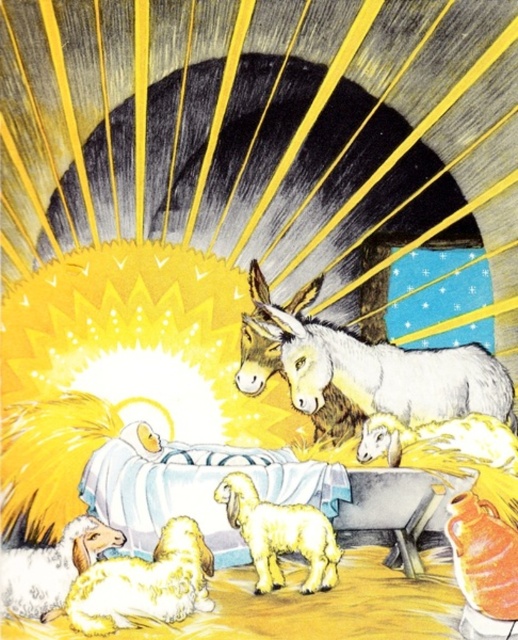
Question: Which point is farther from the camera taking this photo?

Choices:
 (A) (169, 564)
 (B) (309, 577)
 (C) (53, 554)

Answer: (B)

Question: Does fluffy white sheep at lower left come behind fluffy white lamb at center?

Choices:
 (A) no
 (B) yes

Answer: (A)

Question: Can you confirm if white textured donkey at center is thinner than fluffy white lamb at center?

Choices:
 (A) yes
 (B) no

Answer: (B)

Question: Among these points, which one is farthest from the camera?

Choices:
 (A) (54, 589)
 (B) (299, 328)

Answer: (B)

Question: Can you confirm if white textured donkey at center is positioned to the right of fluffy white lamb at center?

Choices:
 (A) yes
 (B) no

Answer: (A)

Question: Which object is positioned farthest from the fluffy white sheep at lower left?

Choices:
 (A) fluffy white lamb at center
 (B) white woolen sheep at lower left
 (C) white textured donkey at center

Answer: (C)